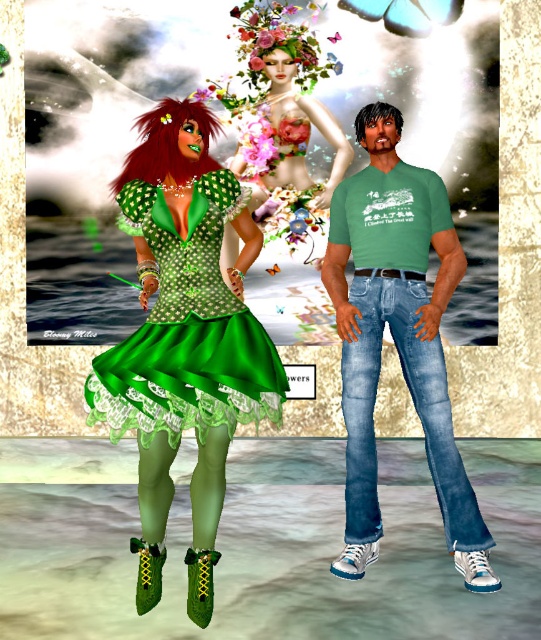
Question: Which of the following is the closest to the observer?

Choices:
 (A) pos(403,122)
 (B) pos(408,362)
 (C) pos(167,118)

Answer: (C)

Question: Is green polka dot fabric dress at left below shiny red hair at center?

Choices:
 (A) yes
 (B) no

Answer: (A)

Question: Is green polka dot fabric dress at left bigger than dark brown matte hair at upper center?

Choices:
 (A) yes
 (B) no

Answer: (A)

Question: Which point is farther from the camera taking this photo?

Choices:
 (A) (392, 288)
 (B) (187, 177)
 (C) (355, 138)
 (D) (208, 280)

Answer: (C)

Question: Considering the relative positions of shiny red hair at center and dark brown matte hair at upper center in the image provided, where is shiny red hair at center located with respect to dark brown matte hair at upper center?

Choices:
 (A) above
 (B) below

Answer: (B)

Question: Which of these objects is positioned closest to the dark brown matte hair at upper center?

Choices:
 (A) shiny red hair at center
 (B) blue denim jeans at center

Answer: (A)